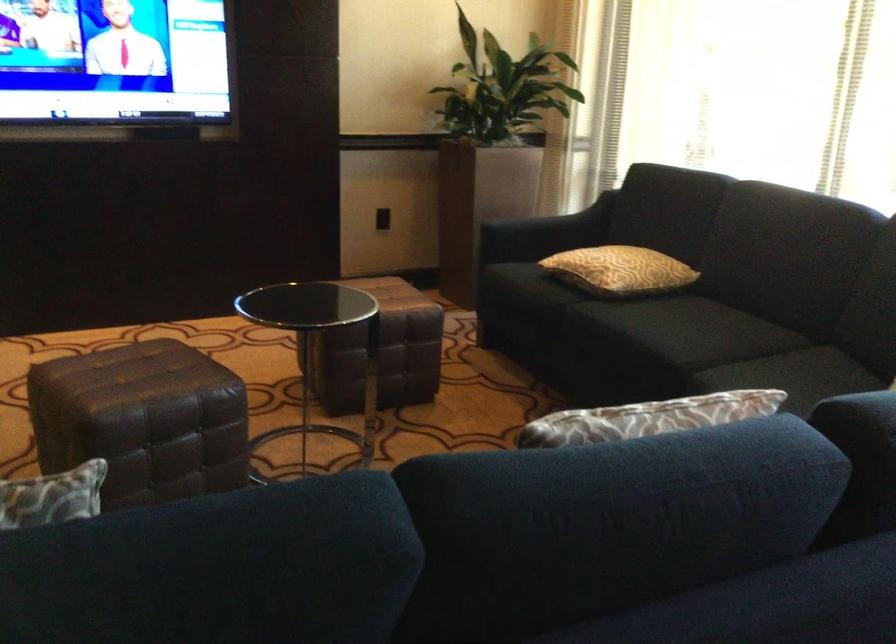
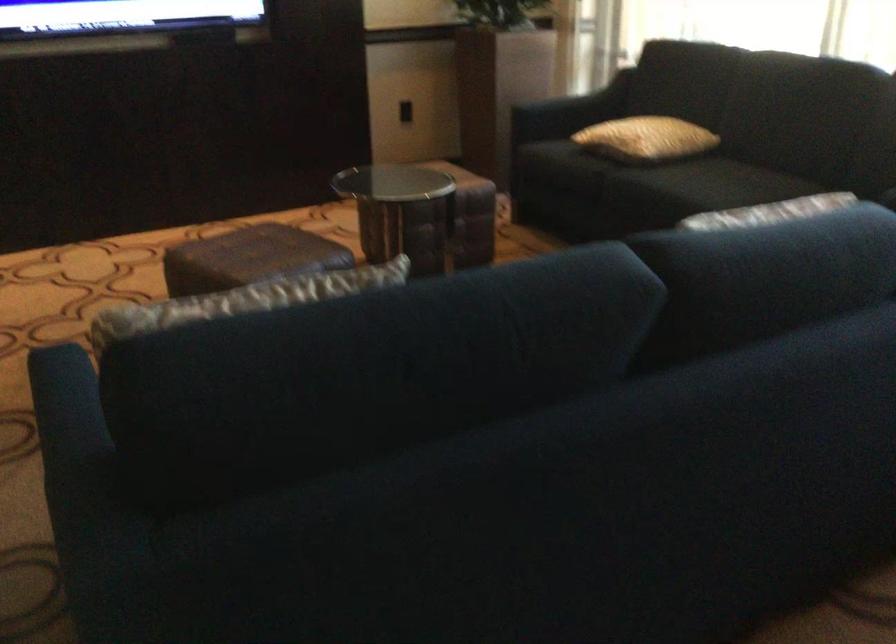
Where in the second image is the point corresponding to pixel 123 382 from the first image?

(248, 258)